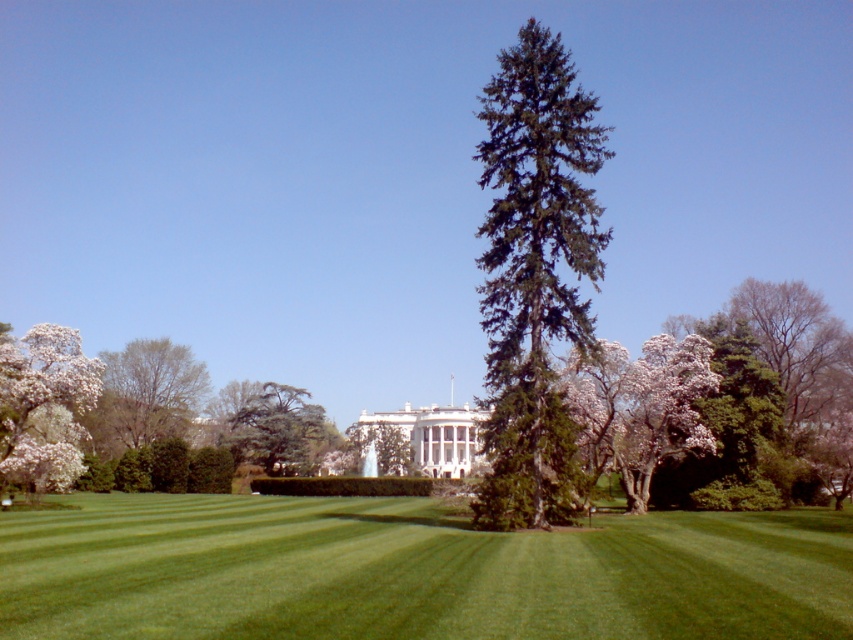
You are a landscape architect designing a garden path that needs to pass between the green leafy tree at left and the green textured tree at center. The path must be at least 2 meters wide to accommodate wheelchairs. Can the path fit between them based on their heights?

The green leafy tree at left is taller than the green textured tree at center, but the question is about horizontal space for the path. The provided information does not mention the horizontal distance between them, so we cannot determine if the path can fit.